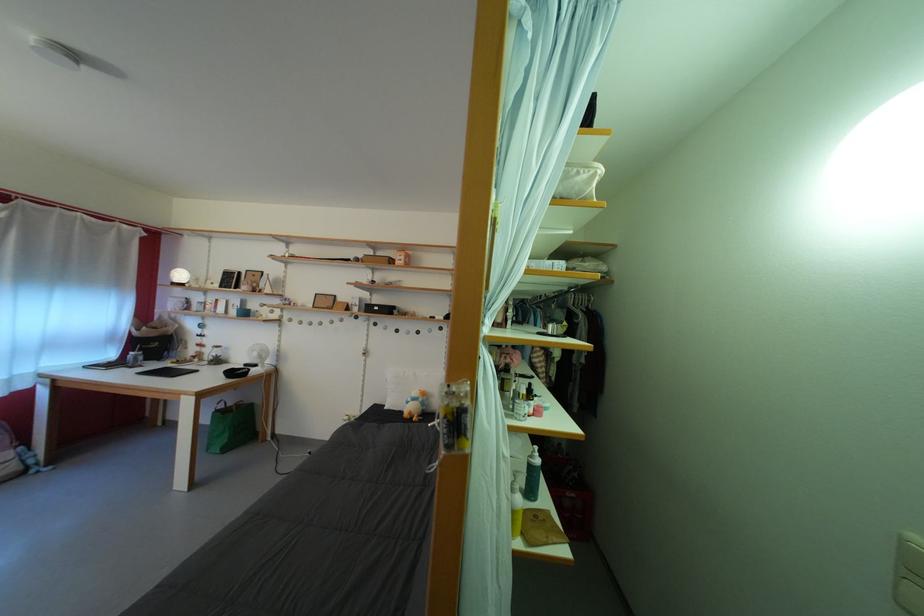
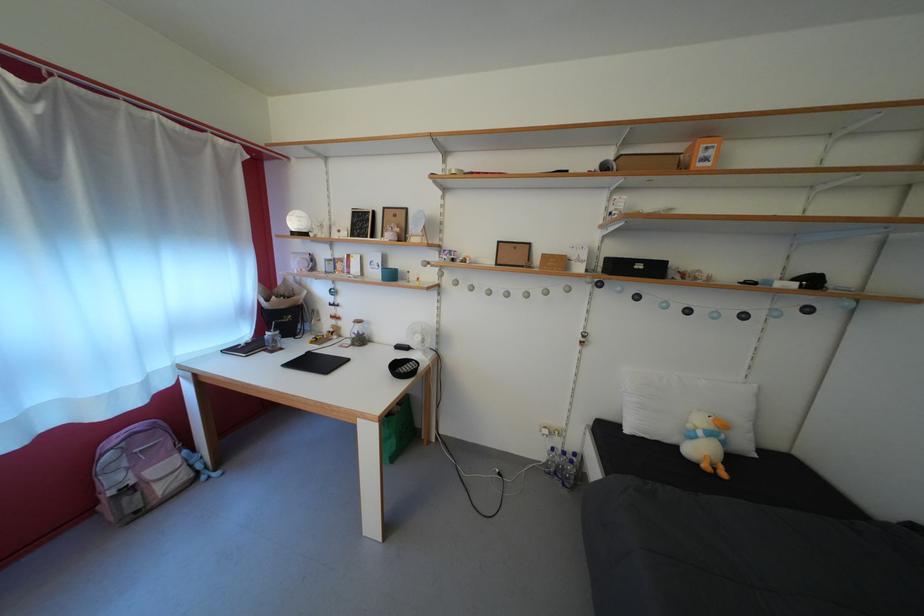
Locate, in the second image, the point that corresponds to pixel 431 410 in the first image.

(732, 448)